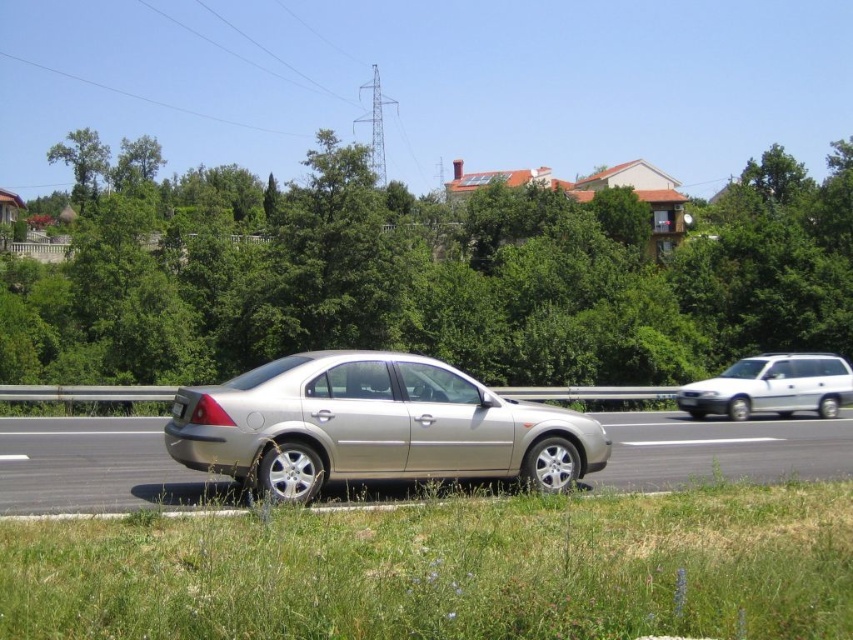
You are standing at the point labeled point (85, 168) and want to walk to the point labeled point (692, 275). Which direction should you face to move towards your destination?

You should face towards the direction away from the viewer because point (692, 275) is closer to the viewer than point (85, 168).

You are a driver who wants to park your car in the parking lot. You see the silver metallic car at center and the silver metallic license plate at center in the image. Which object is bigger?

The silver metallic car at center is larger in size than the silver metallic license plate at center, so the silver metallic car at center is bigger.

You are a driver approaching the silver metallic car at center and the silver metallic license plate at center. Which object is closer to the right edge of the road?

The silver metallic car at center is positioned on the right side of the silver metallic license plate at center, so the silver metallic car at center is closer to the right edge of the road.